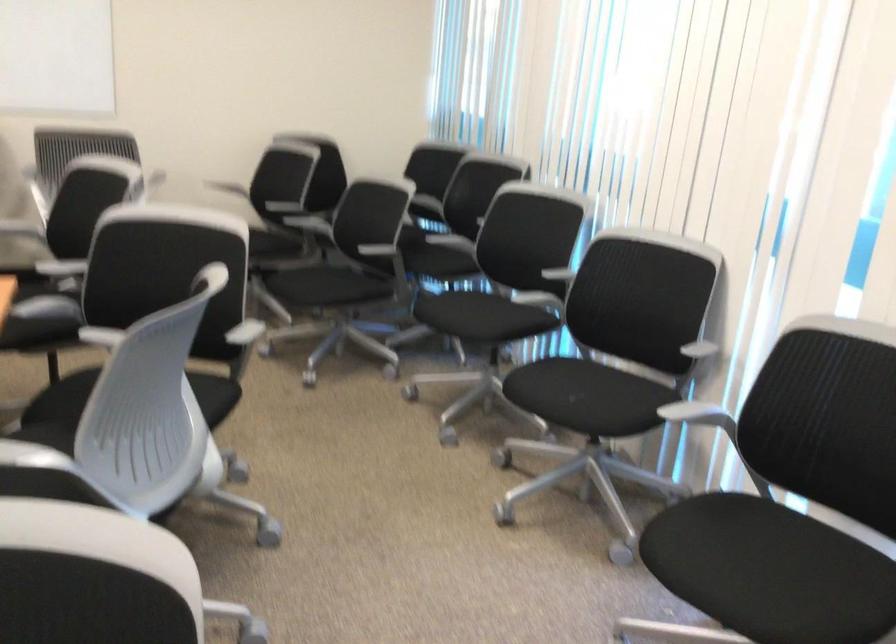
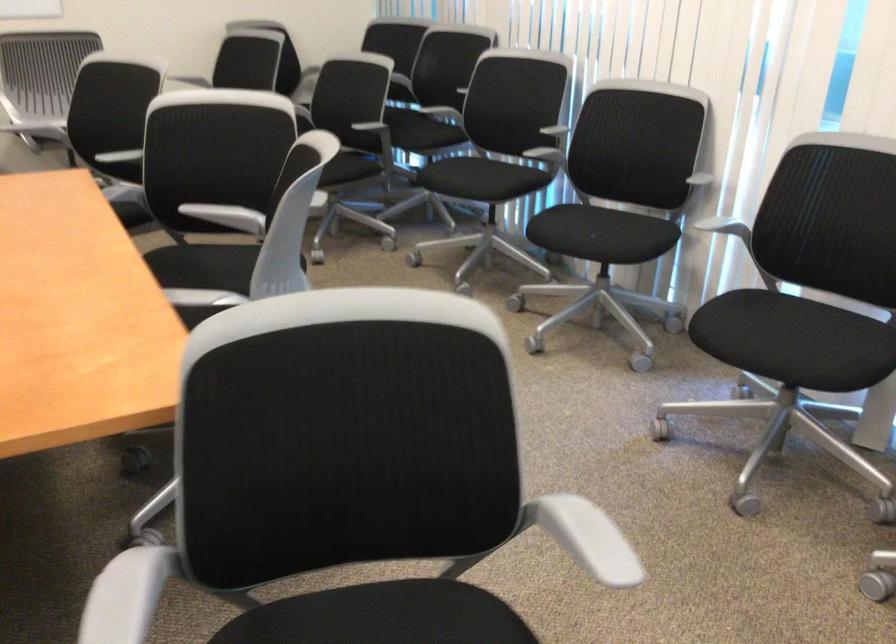
Locate, in the second image, the point that corresponds to point 109,336 in the first image.

(208, 212)